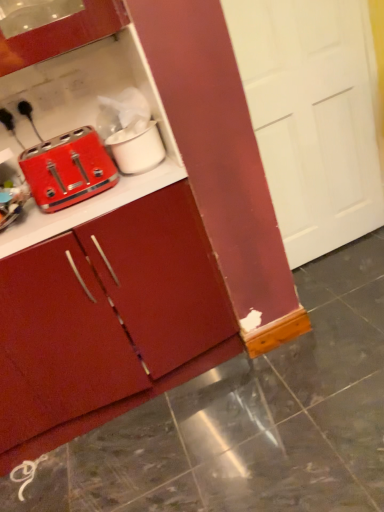
The height and width of the screenshot is (512, 384). In order to click on free space above white glossy tile at lower left (from a real-world perspective) in this screenshot , I will do `click(26, 476)`.